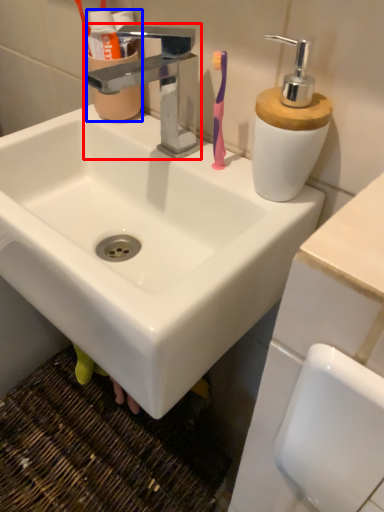
Question: Which of the following is the farthest to the observer, tap (highlighted by a red box) or mouthwash (highlighted by a blue box)?

Choices:
 (A) tap
 (B) mouthwash

Answer: (B)